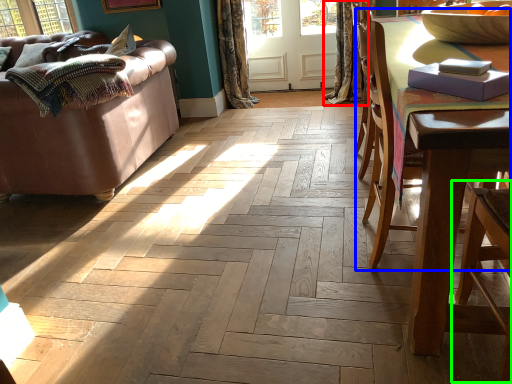
Question: Which is nearer to the curtain (highlighted by a red box)? chair (highlighted by a blue box) or armchair (highlighted by a green box).

Choices:
 (A) chair
 (B) armchair

Answer: (A)